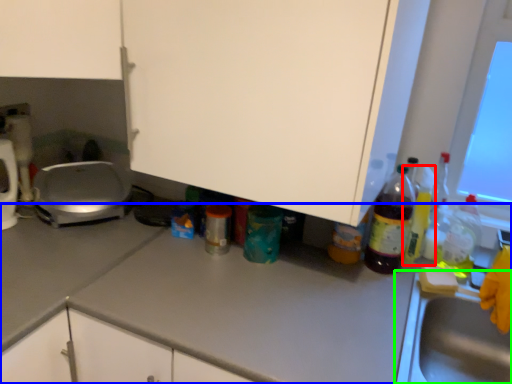
Question: Which is farther away from bottle (highlighted by a red box)? countertop (highlighted by a blue box) or sink (highlighted by a green box)?

Choices:
 (A) countertop
 (B) sink

Answer: (A)